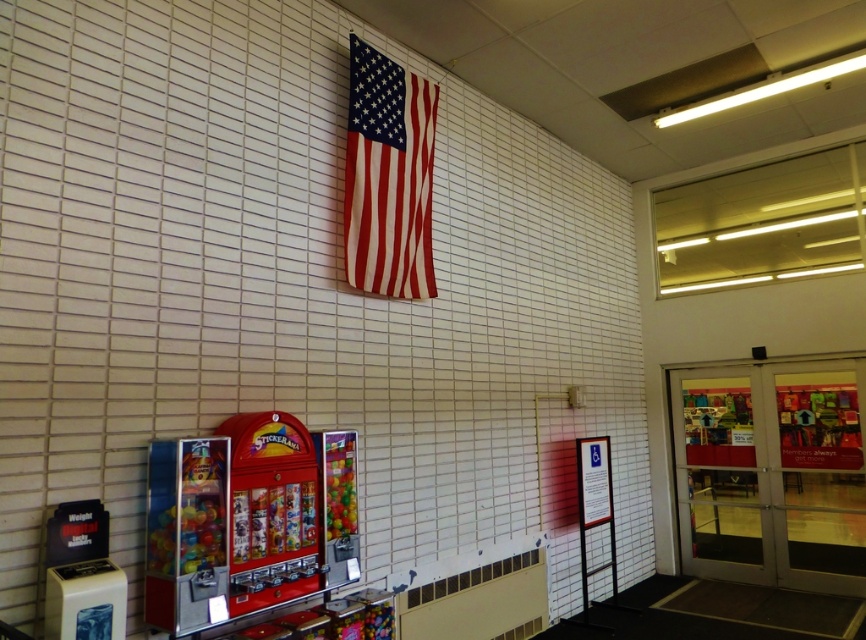
Question: Which point is closer to the camera taking this photo?

Choices:
 (A) (347, 186)
 (B) (237, 516)

Answer: (B)

Question: Is matte fabric flag at upper center wider than shiny red vending machine at center?

Choices:
 (A) no
 (B) yes

Answer: (B)

Question: Does matte fabric flag at upper center lie behind shiny red vending machine at center?

Choices:
 (A) yes
 (B) no

Answer: (A)

Question: Is matte fabric flag at upper center thinner than shiny red vending machine at center?

Choices:
 (A) no
 (B) yes

Answer: (A)

Question: Among these objects, which one is nearest to the camera?

Choices:
 (A) matte fabric flag at upper center
 (B) shiny red vending machine at center

Answer: (B)